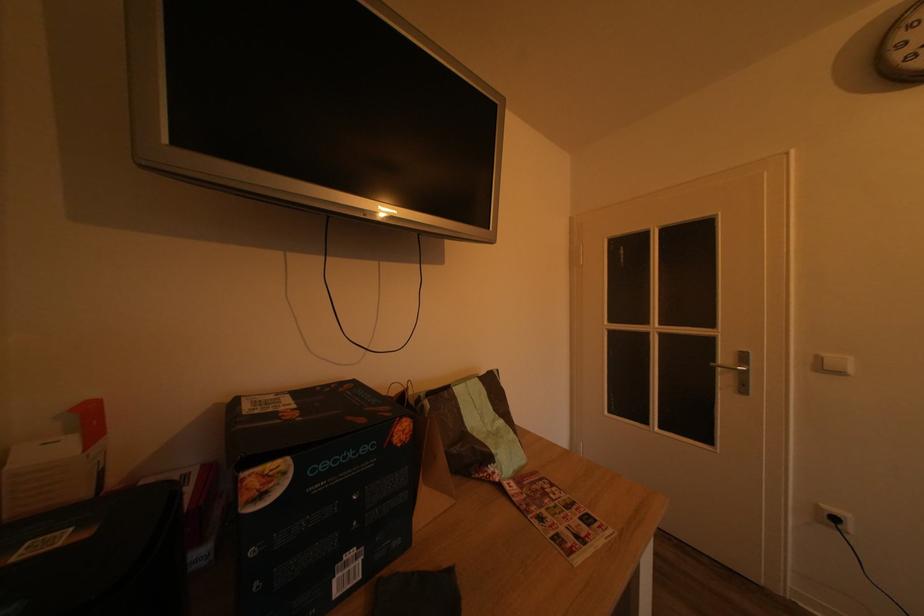
Describe the element at coordinates (738, 371) in the screenshot. Image resolution: width=924 pixels, height=616 pixels. I see `a silver door handle` at that location.